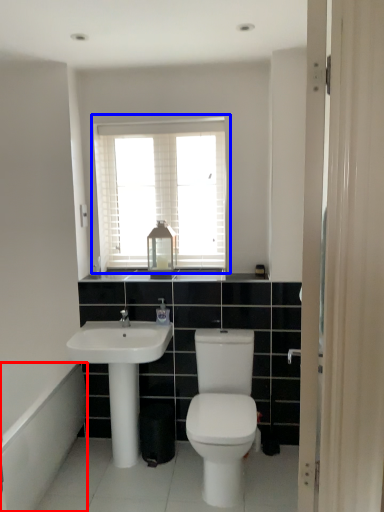
Question: Which object is closer to the camera taking this photo, bath (highlighted by a red box) or window (highlighted by a blue box)?

Choices:
 (A) bath
 (B) window

Answer: (A)